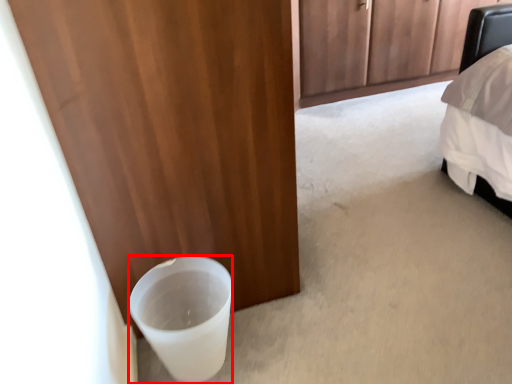
Question: Considering the relative positions of beverage (annotated by the red box) and door in the image provided, where is beverage (annotated by the red box) located with respect to the staircase?

Choices:
 (A) right
 (B) left

Answer: (A)